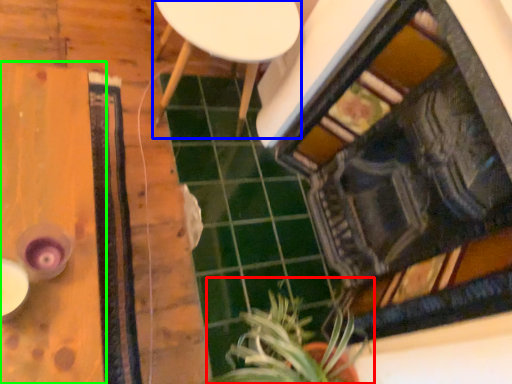
Question: Considering the real-world distances, which object is closest to houseplant (highlighted by a red box)? furniture (highlighted by a blue box) or table (highlighted by a green box).

Choices:
 (A) furniture
 (B) table

Answer: (B)